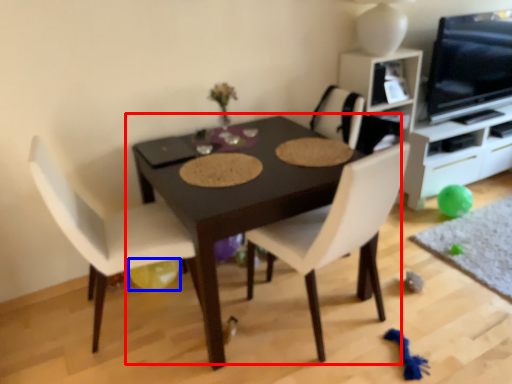
Question: Which of the following is the farthest to the observer, table (highlighted by a red box) or balloon (highlighted by a blue box)?

Choices:
 (A) table
 (B) balloon

Answer: (B)